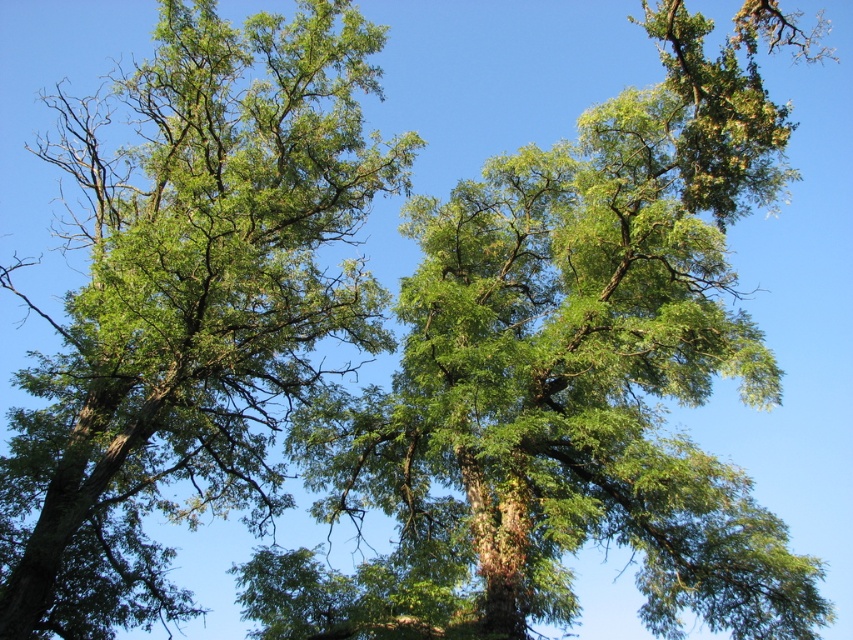
You are a bird looking for a place to perch. You see two trees, the green leafy oak tree at center and the green leafy tree at center. Which tree is closer to the other?

Both trees are positioned at the center, but the green leafy oak tree at center and the green leafy tree at center are 4.12 meters apart from each other.

You are standing in a garden and want to take a photo of both the green leafy oak tree at center and the green leafy tree at center. Which tree should you focus on first to ensure both are in clear view?

You should focus on the green leafy oak tree at center first because it is closer to you than the green leafy tree at center, so adjusting focus from near to far will help capture both clearly.